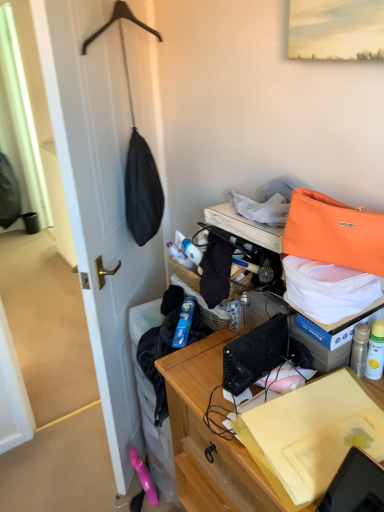
Describe the element at coordinates (328, 288) in the screenshot. I see `orange leather handbag at upper right` at that location.

Find the location of a particular element. white matte box at upper right is located at coordinates (331, 335).

You are a GUI agent. You are given a task and a screenshot of the screen. Output one action in this format:
    pyautogui.click(x=<x>, y=<y>)
    Task: Click on the orange leather handbag at upper right
    The height and width of the screenshot is (512, 384).
    Given the screenshot: What is the action you would take?
    pyautogui.click(x=328, y=288)

How much distance is there between wooden desk at center and orange leather handbag at upper right?

wooden desk at center is 19.26 inches away from orange leather handbag at upper right.

Considering the positions of point (196, 495) and point (342, 262), is point (196, 495) closer or farther from the camera than point (342, 262)?

Clearly, point (196, 495) is more distant from the camera than point (342, 262).

Is wooden desk at center far away from orange leather handbag at upper right?

wooden desk at center is actually quite close to orange leather handbag at upper right.

This screenshot has width=384, height=512. Find the location of `handbag above the wooden desk at center (from the image's perspective)`. handbag above the wooden desk at center (from the image's perspective) is located at coordinates (334, 232).

Considering the sizes of white matte box at upper right and wooden desk at center in the image, is white matte box at upper right wider or thinner than wooden desk at center?

Considering their sizes, white matte box at upper right looks slimmer than wooden desk at center.

Which is behind, white matte box at upper right or wooden desk at center?

Positioned behind is white matte box at upper right.

From the picture: Is white matte box at upper right taller or shorter than wooden desk at center?

Considering their sizes, white matte box at upper right has less height than wooden desk at center.

Does matte black coat hanger at left turn towards orange leather handbag at upper right?

No, matte black coat hanger at left is not turned towards orange leather handbag at upper right.

Does matte black coat hanger at left have a lesser width compared to orange leather handbag at upper right?

Correct, the width of matte black coat hanger at left is less than that of orange leather handbag at upper right.

Does matte black coat hanger at left have a smaller size compared to orange leather handbag at upper right?

Incorrect, matte black coat hanger at left is not smaller in size than orange leather handbag at upper right.

Is orange leather handbag at upper right in contact with matte black coat hanger at left?

No.

Would you say matte black coat hanger at left is part of orange leather handbag at upper right's contents?

No, orange leather handbag at upper right does not contain matte black coat hanger at left.

Is orange leather handbag at upper right looking in the opposite direction of matte black coat hanger at left?

No, matte black coat hanger at left is not at the back of orange leather handbag at upper right.

Which of these two, orange leather handbag at upper right or matte black coat hanger at left, is smaller?

With smaller size is orange leather handbag at upper right.

From a real-world perspective, is matte black coat hanger at left below white matte box at upper right?

Yes, from a real-world perspective, matte black coat hanger at left is under white matte box at upper right.

From the image's perspective, who appears lower, matte black coat hanger at left or white matte box at upper right?

white matte box at upper right, from the image's perspective.

Is matte black coat hanger at left taller than white matte box at upper right?

Indeed, matte black coat hanger at left has a greater height compared to white matte box at upper right.

Considering the points (82, 275) and (376, 315), which point is behind, point (82, 275) or point (376, 315)?

The point (82, 275) is more distant.

Consider the image. Is white matte box at upper right positioned in front of orange leather handbag at upper right?

That is False.

Is white matte box at upper right positioned with its back to orange leather handbag at upper right?

No, orange leather handbag at upper right is not at the back of white matte box at upper right.

Is white matte box at upper right outside of orange leather handbag at upper right?

Yes, white matte box at upper right is outside of orange leather handbag at upper right.

Considering the points (332, 227) and (369, 321), which point is behind, point (332, 227) or point (369, 321)?

Positioned behind is point (369, 321).

In the scene shown: Which is correct: orange leather handbag at upper right is inside white matte box at upper right, or outside of it?

orange leather handbag at upper right is outside white matte box at upper right.

Could you tell me if orange leather handbag at upper right is turned towards white matte box at upper right?

No, orange leather handbag at upper right is not aimed at white matte box at upper right.

How many degrees apart are the facing directions of orange leather handbag at upper right and white matte box at upper right?

There is a 32.4-degree angle between the facing directions of orange leather handbag at upper right and white matte box at upper right.

This screenshot has width=384, height=512. Identify the location of handbag that appears above the wooden desk at center (from a real-world perspective). (334, 232).

Locate an element on the screen. box that appears behind the wooden desk at center is located at coordinates (331, 335).

Looking at the image, which one is located further to white matte box at upper right, matte black coat hanger at left or orange leather handbag at upper right?

matte black coat hanger at left.

Which object lies nearer to the anchor point matte black coat hanger at left, white matte box at upper right or wooden desk at center?

wooden desk at center is closer to matte black coat hanger at left.

Estimate the real-world distances between objects in this image. Which object is further from wooden desk at center, orange leather handbag at upper right or white matte box at upper right?

orange leather handbag at upper right.

From the image, which object appears to be nearer to matte black coat hanger at left, orange leather handbag at upper right or wooden desk at center?

wooden desk at center lies closer to matte black coat hanger at left than the other object.

Considering their positions, is orange leather handbag at upper right positioned further to matte black coat hanger at left than wooden desk at center?

orange leather handbag at upper right.

Looking at the image, which one is located closer to white matte box at upper right, orange leather handbag at upper right or orange leather handbag at upper right?

Among the two, orange leather handbag at upper right is located nearer to white matte box at upper right.

Which object lies nearer to the anchor point orange leather handbag at upper right, white matte box at upper right or matte black coat hanger at left?

white matte box at upper right lies closer to orange leather handbag at upper right than the other object.

From the image, which object appears to be nearer to matte black coat hanger at left, orange leather handbag at upper right or white matte box at upper right?

orange leather handbag at upper right lies closer to matte black coat hanger at left than the other object.

Identify the location of kit between orange leather handbag at upper right and white matte box at upper right in the up-down direction. (328, 288).

The image size is (384, 512). Identify the location of handbag between matte black coat hanger at left and white matte box at upper right from left to right. (334, 232).

Locate an element on the screen. This screenshot has width=384, height=512. handbag between matte black coat hanger at left and orange leather handbag at upper right is located at coordinates (334, 232).

The width and height of the screenshot is (384, 512). Identify the location of kit between orange leather handbag at upper right and wooden desk at center from top to bottom. (328, 288).